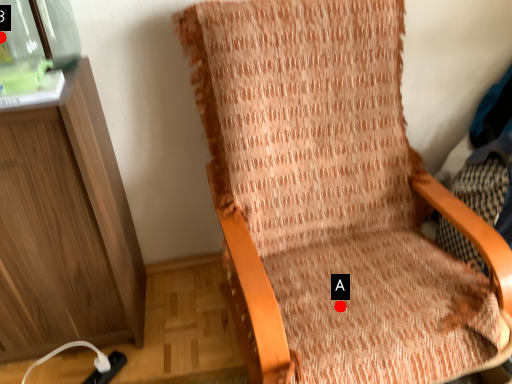
Question: Two points are circled on the image, labeled by A and B beside each circle. Among these points, which one is nearest to the camera?

Choices:
 (A) A is closer
 (B) B is closer

Answer: (A)